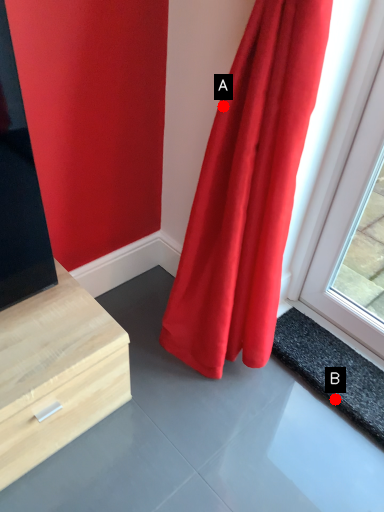
Question: Two points are circled on the image, labeled by A and B beside each circle. Which point is farther from the camera taking this photo?

Choices:
 (A) A is further
 (B) B is further

Answer: (B)